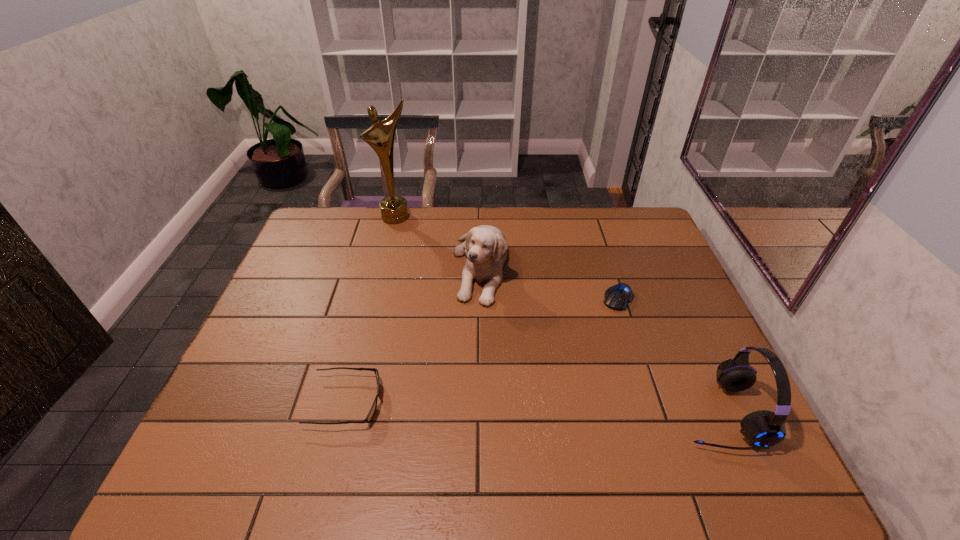
Locate an element on the screen. free point between the rightmost object and the third object from right to left is located at coordinates (599, 340).

This screenshot has width=960, height=540. What are the coordinates of `vacant space that's between the computer mouse and the fourth tallest object` in the screenshot? It's located at (482, 350).

You are a GUI agent. You are given a task and a screenshot of the screen. Output one action in this format:
    pyautogui.click(x=<x>, y=<y>)
    Task: Click on the vacant area between the second shortest object and the shortest object
    
    Given the screenshot: What is the action you would take?
    pyautogui.click(x=482, y=350)

The image size is (960, 540). Identify the location of object that can be found as the third closest to the rightmost object. (371, 413).

Locate an element on the screen. object that is the fourth closest one to the third object from left to right is located at coordinates (763, 429).

Locate an element on the screen. This screenshot has height=540, width=960. blank area in the image that satisfies the following two spatial constraints: 1. on the front side of the award; 2. on the ear cushions of the rightmost object is located at coordinates (348, 413).